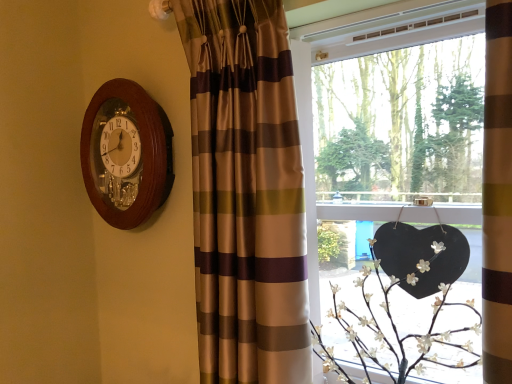
Question: Considering the relative positions of wooden wall clock at upper left and brown striped curtain at left in the image provided, is wooden wall clock at upper left to the right of brown striped curtain at left from the viewer's perspective?

Choices:
 (A) no
 (B) yes

Answer: (A)

Question: Is wooden wall clock at upper left smaller than brown striped curtain at left?

Choices:
 (A) no
 (B) yes

Answer: (B)

Question: Is wooden wall clock at upper left aimed at brown striped curtain at left?

Choices:
 (A) no
 (B) yes

Answer: (A)

Question: From the image's perspective, is wooden wall clock at upper left on top of brown striped curtain at left?

Choices:
 (A) yes
 (B) no

Answer: (A)

Question: Is brown striped curtain at left a part of wooden wall clock at upper left?

Choices:
 (A) yes
 (B) no

Answer: (B)

Question: From a real-world perspective, is wooden wall clock at upper left physically below brown striped curtain at left?

Choices:
 (A) yes
 (B) no

Answer: (B)

Question: Is matte black heart at right facing away from brown striped curtain at left?

Choices:
 (A) yes
 (B) no

Answer: (B)

Question: From a real-world perspective, does matte black heart at right stand above brown striped curtain at left?

Choices:
 (A) yes
 (B) no

Answer: (B)

Question: Is the depth of matte black heart at right less than that of brown striped curtain at left?

Choices:
 (A) no
 (B) yes

Answer: (B)

Question: Is matte black heart at right bigger than brown striped curtain at left?

Choices:
 (A) yes
 (B) no

Answer: (A)

Question: Can you confirm if matte black heart at right is shorter than brown striped curtain at left?

Choices:
 (A) no
 (B) yes

Answer: (A)

Question: Could you tell me if matte black heart at right is facing brown striped curtain at left?

Choices:
 (A) yes
 (B) no

Answer: (A)

Question: Does wooden wall clock at upper left have a larger size compared to matte black heart at right?

Choices:
 (A) yes
 (B) no

Answer: (B)